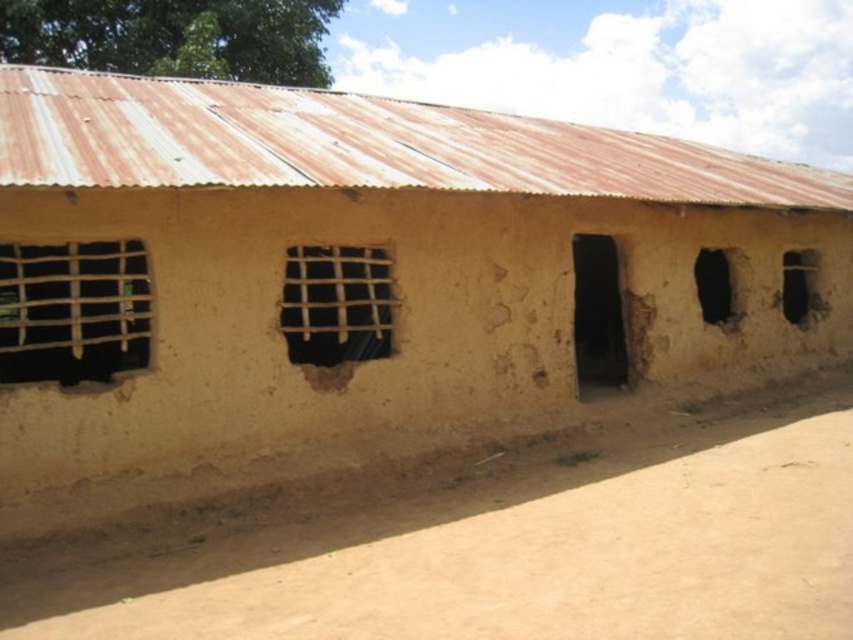
Is point (106, 364) closer to camera compared to point (602, 332)?

That is True.

From the picture: Can you confirm if wooden lattice window at left is smaller than black matte door at center?

Yes.

Identify the location of wooden lattice window at left. (73, 310).

Is the position of brown rough mud at center more distant than that of transparent plastic window at center right?

No, it is not.

Measure the distance between brown rough mud at center and transparent plastic window at center right.

brown rough mud at center and transparent plastic window at center right are 30.91 feet apart from each other.

Locate an element on the screen. The width and height of the screenshot is (853, 640). brown rough mud at center is located at coordinates (498, 541).

At what (x,y) coordinates should I click in order to perform the action: click on brown mud hut at center. Please return your answer as a coordinate pair (x, y). This screenshot has width=853, height=640. Looking at the image, I should click on (347, 244).

Is brown mud hut at center taller than wooden lattice window at center?

Correct, brown mud hut at center is much taller as wooden lattice window at center.

I want to click on brown mud hut at center, so click(x=347, y=244).